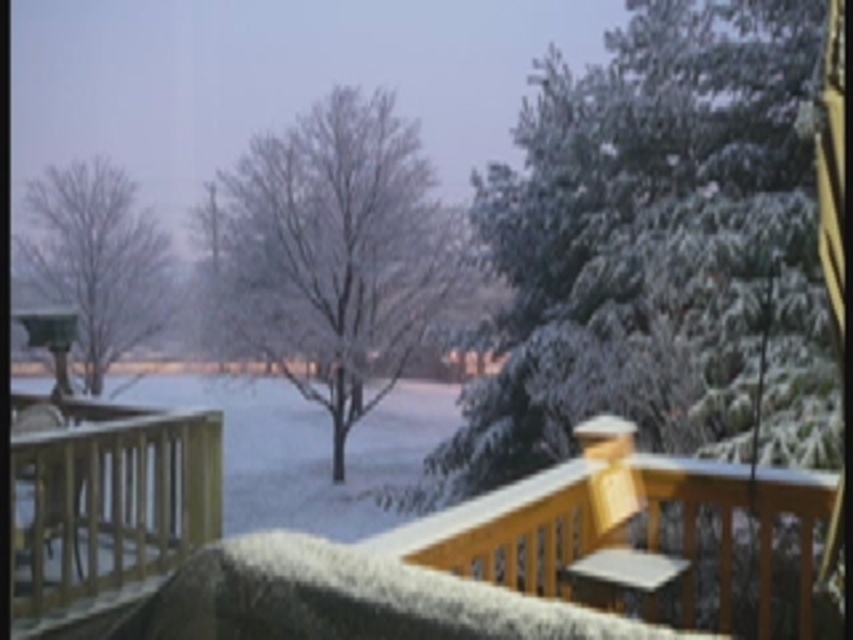
You are standing on the wooden porch at center and want to walk to the bare wood tree at left. Which direction should you move relative to the tree?

You should move to the left relative to the bare wood tree at left because the wooden porch at center is positioned on the right side of it.

You are standing on the wooden deck and want to reach the point marked at coordinates (100, 572). Can you safely walk straight towards it without falling off the deck?

The point marked at coordinates (100, 572) is 6.32 meters away from you. Since it is within the deck area, you can safely walk straight towards it without falling off.